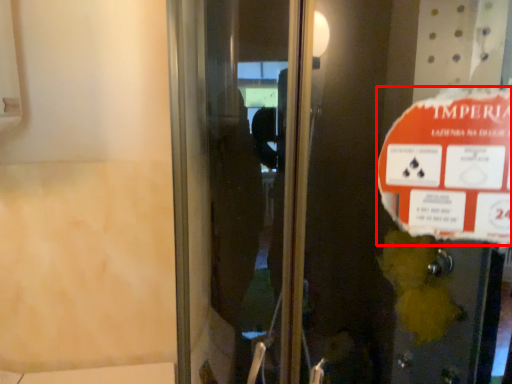
Question: Where is street sign (annotated by the red box) located in relation to elevator door in the image?

Choices:
 (A) left
 (B) right

Answer: (B)